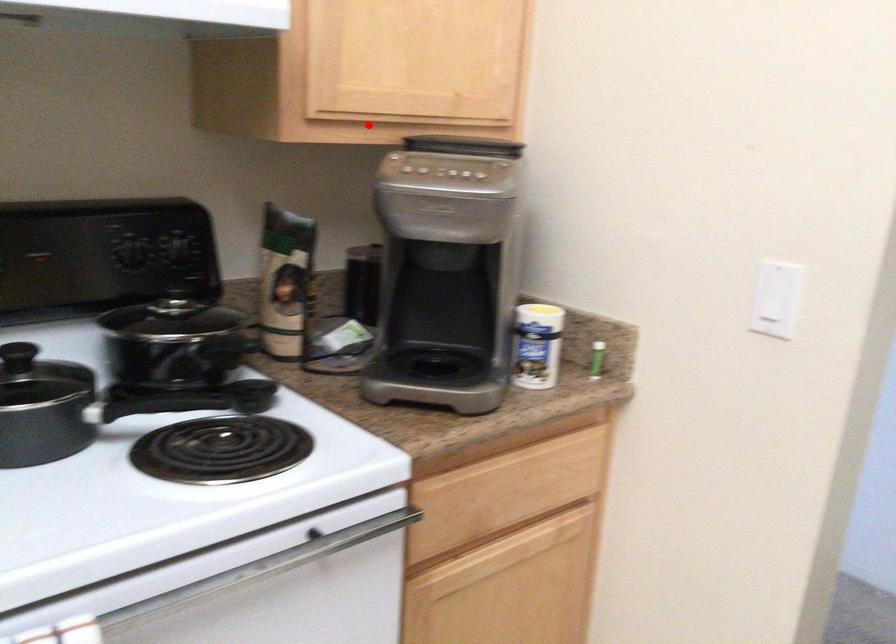
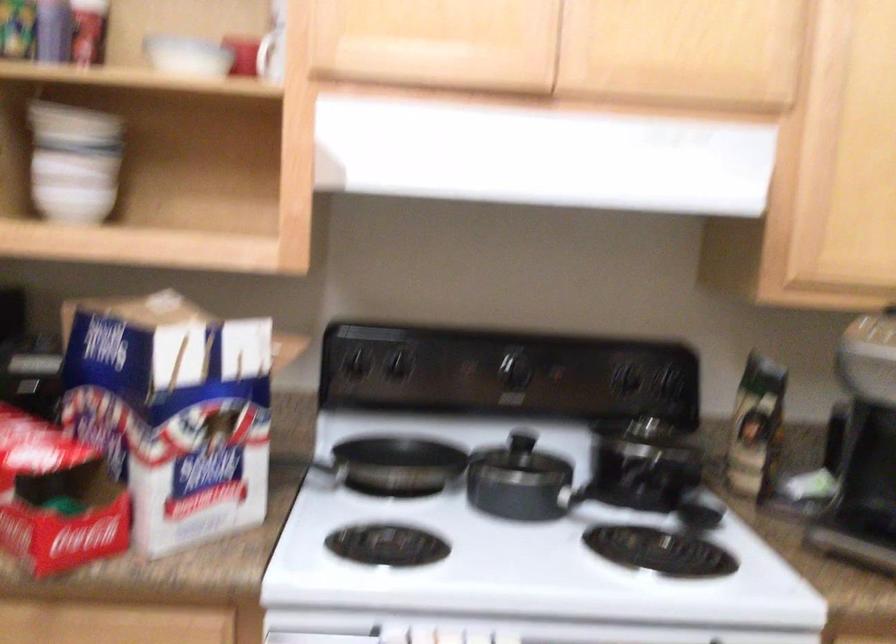
Find the pixel in the second image that matches the highlighted location in the first image.

(847, 283)